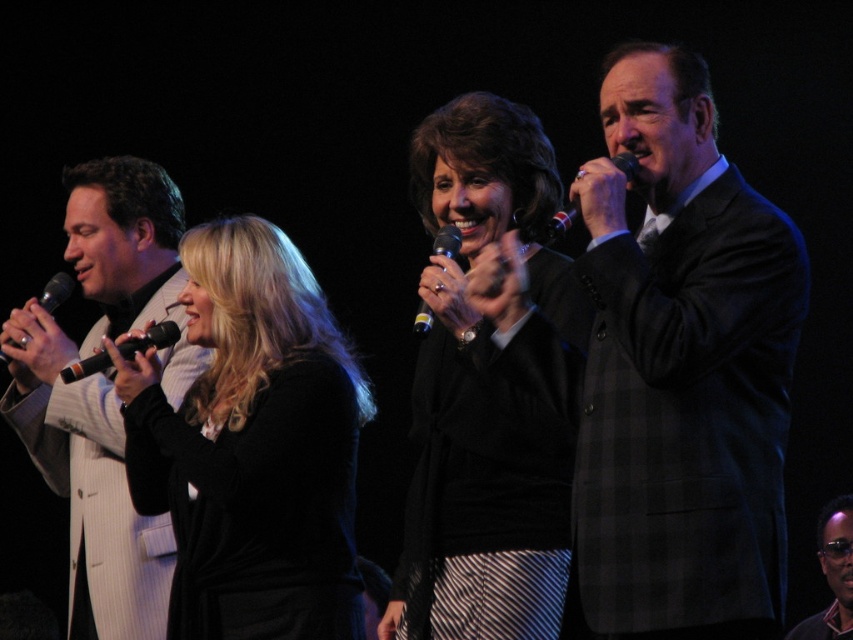
Question: Which of the following is the closest to the observer?

Choices:
 (A) (67, 288)
 (B) (438, 304)

Answer: (B)

Question: Estimate the real-world distances between objects in this image. Which object is farther from the white pinstripe suit at left?

Choices:
 (A) black matte sweater at center
 (B) black matte microphone at left
 (C) black plastic microphone at center
 (D) black plastic microphone at left

Answer: (C)

Question: Is white pinstripe suit at left above black plastic microphone at upper right?

Choices:
 (A) no
 (B) yes

Answer: (A)

Question: Is white pinstripe suit at left positioned before black textured suit at center?

Choices:
 (A) yes
 (B) no

Answer: (A)

Question: Which of these objects is positioned farthest from the black matte microphone at left?

Choices:
 (A) black plastic microphone at left
 (B) black plastic microphone at center
 (C) dark gray checkered suit at right

Answer: (C)

Question: Does black matte sweater at center appear over white pinstripe suit at left?

Choices:
 (A) no
 (B) yes

Answer: (B)